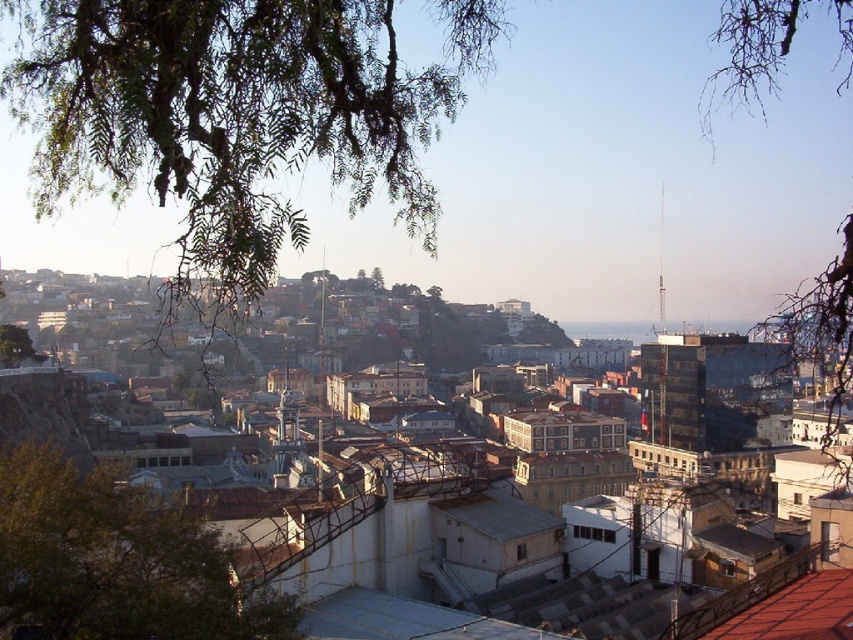
Question: Considering the real-world distances, which object is closest to the green leafy tree at upper left?

Choices:
 (A) green leafy branches at upper left
 (B) bare branches at upper left
 (C) green leafy tree at lower left

Answer: (A)

Question: Is green leafy branches at upper left further to camera compared to green leafy tree at upper left?

Choices:
 (A) yes
 (B) no

Answer: (B)

Question: Can you confirm if bare branches at upper left is positioned to the left of green leafy tree at upper left?

Choices:
 (A) no
 (B) yes

Answer: (A)

Question: In this image, where is green leafy branches at upper left located relative to green leafy tree at upper left?

Choices:
 (A) right
 (B) left

Answer: (A)

Question: Among these points, which one is farthest from the camera?

Choices:
 (A) (218, 44)
 (B) (28, 364)
 (C) (88, 486)
 (D) (723, 77)

Answer: (D)

Question: Which point is closer to the camera?

Choices:
 (A) (734, 42)
 (B) (3, 324)
 (C) (73, 509)
 (D) (387, 131)

Answer: (D)